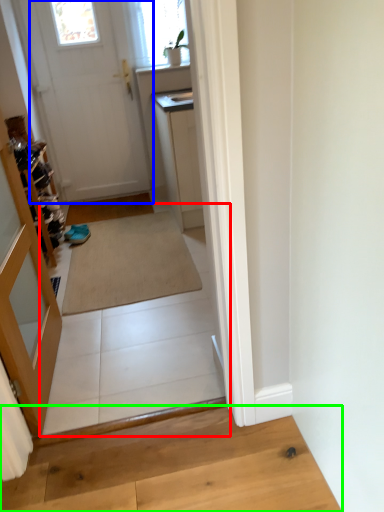
Question: Estimate the real-world distances between objects in this image. Which object is closer to path (highlighted by a red box), door (highlighted by a blue box) or hardwood (highlighted by a green box)?

Choices:
 (A) door
 (B) hardwood

Answer: (B)